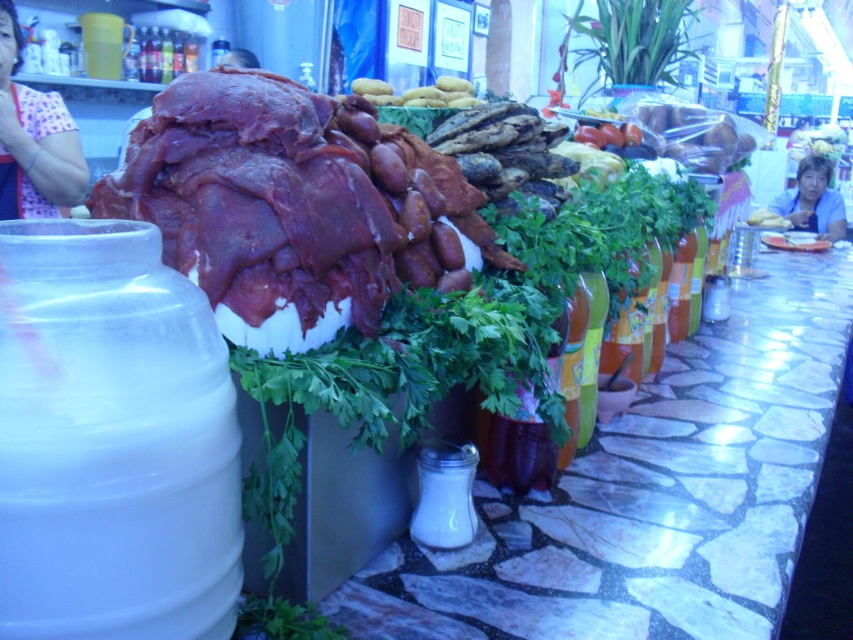
Is raw red meat at center taller than golden brown bread at center?

Yes.

Which is above, raw red meat at center or golden brown bread at center?

golden brown bread at center is higher up.

Is point (190, 80) less distant than point (384, 99)?

Yes.

At what (x,y) coordinates should I click in order to perform the action: click on raw red meat at center. Please return your answer as a coordinate pair (x, y). Image resolution: width=853 pixels, height=640 pixels. Looking at the image, I should click on (260, 208).

Is pink floral shirt at upper left taller than blue fabric shirt at upper right?

No.

Does pink floral shirt at upper left have a smaller size compared to blue fabric shirt at upper right?

Indeed, pink floral shirt at upper left has a smaller size compared to blue fabric shirt at upper right.

This screenshot has height=640, width=853. In order to click on pink floral shirt at upper left in this screenshot , I will do `click(33, 140)`.

Can you confirm if pink floral shirt at upper left is thinner than golden brown bread at center?

Indeed, pink floral shirt at upper left has a lesser width compared to golden brown bread at center.

Does pink floral shirt at upper left have a lesser height compared to golden brown bread at center?

In fact, pink floral shirt at upper left may be taller than golden brown bread at center.

What do you see at coordinates (33, 140) in the screenshot? This screenshot has height=640, width=853. I see `pink floral shirt at upper left` at bounding box center [33, 140].

This screenshot has height=640, width=853. I want to click on pink floral shirt at upper left, so click(x=33, y=140).